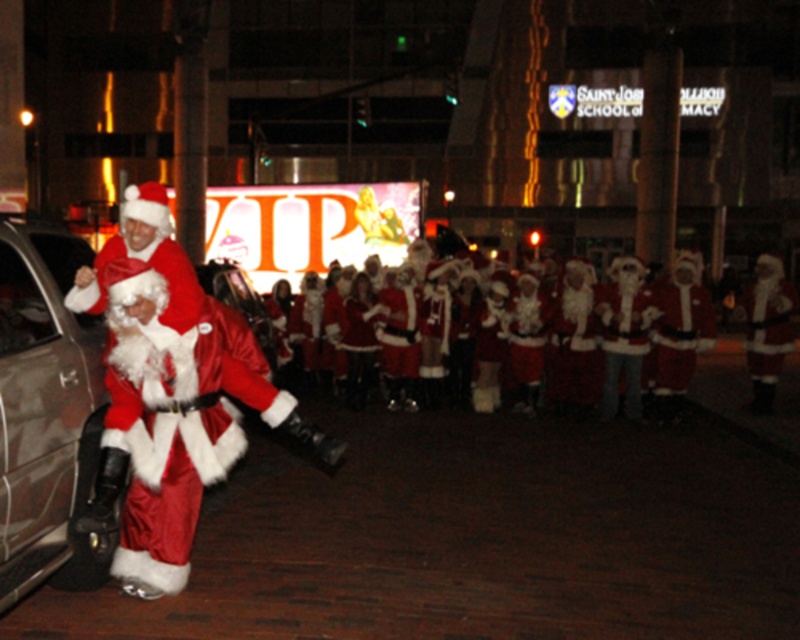
Is velvet red santa at left to the right of metallic gray car at left from the viewer's perspective?

Yes, velvet red santa at left is to the right of metallic gray car at left.

The image size is (800, 640). What do you see at coordinates (168, 397) in the screenshot?
I see `velvet red santa at left` at bounding box center [168, 397].

Who is more forward, (160, 285) or (78, 417)?

Point (160, 285) is more forward.

Where is `velvet red santa at left`? Image resolution: width=800 pixels, height=640 pixels. velvet red santa at left is located at coordinates (168, 397).